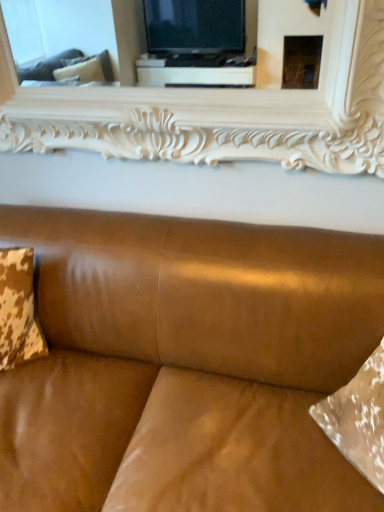
Question: Is white carved wood mirror at upper center next to satin brown leather couch at center and touching it?

Choices:
 (A) yes
 (B) no

Answer: (B)

Question: Considering the relative sizes of white carved wood mirror at upper center and satin brown leather couch at center in the image provided, is white carved wood mirror at upper center taller than satin brown leather couch at center?

Choices:
 (A) yes
 (B) no

Answer: (B)

Question: Does white carved wood mirror at upper center have a smaller size compared to satin brown leather couch at center?

Choices:
 (A) no
 (B) yes

Answer: (B)

Question: Is white carved wood mirror at upper center to the right of satin brown leather couch at center from the viewer's perspective?

Choices:
 (A) no
 (B) yes

Answer: (B)

Question: Does white carved wood mirror at upper center contain satin brown leather couch at center?

Choices:
 (A) no
 (B) yes

Answer: (A)

Question: Considering the relative sizes of white carved wood mirror at upper center and satin brown leather couch at center in the image provided, is white carved wood mirror at upper center bigger than satin brown leather couch at center?

Choices:
 (A) no
 (B) yes

Answer: (A)

Question: Is cowhide fabric pillow at left thinner than white carved wood mirror at upper center?

Choices:
 (A) yes
 (B) no

Answer: (B)

Question: From the image's perspective, would you say cowhide fabric pillow at left is positioned over white carved wood mirror at upper center?

Choices:
 (A) yes
 (B) no

Answer: (B)

Question: Is cowhide fabric pillow at left to the right of white carved wood mirror at upper center from the viewer's perspective?

Choices:
 (A) no
 (B) yes

Answer: (A)

Question: From a real-world perspective, is cowhide fabric pillow at left under white carved wood mirror at upper center?

Choices:
 (A) yes
 (B) no

Answer: (A)

Question: From the image's perspective, is cowhide fabric pillow at left under white carved wood mirror at upper center?

Choices:
 (A) yes
 (B) no

Answer: (A)

Question: Is cowhide fabric pillow at left looking in the opposite direction of white carved wood mirror at upper center?

Choices:
 (A) yes
 (B) no

Answer: (B)

Question: Is satin brown leather couch at center shorter than cowhide fabric pillow at left?

Choices:
 (A) yes
 (B) no

Answer: (B)